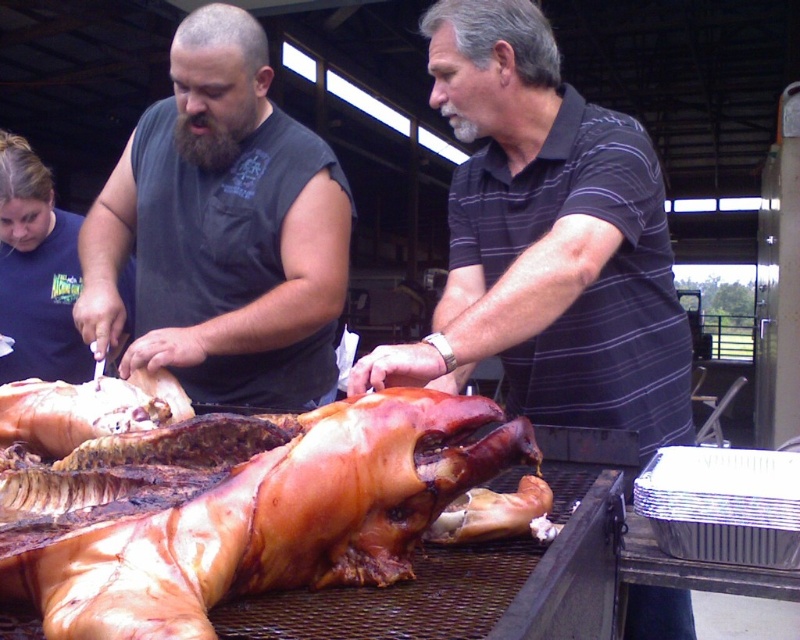
You are a chef at a barbecue event and need to check the cooking progress of the brown crispy skin at center. You are wearing the dark gray sleeveless shirt at center. Which part of your outfit is more likely to get grease splatter from the pig?

The brown crispy skin at center occupies less space than the dark gray sleeveless shirt at center, so the shirt is more likely to get grease splatter because it covers a larger area and is closer to the pig.